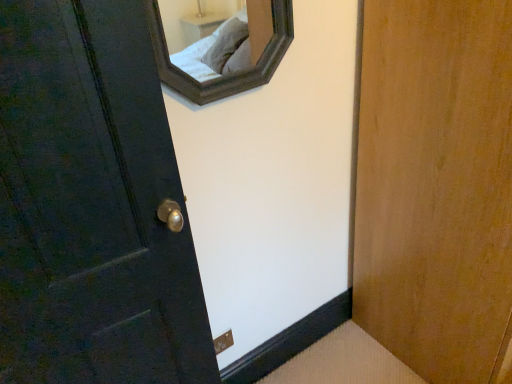
Question: Which direction should I rotate to look at brown matte electric outlet at lower center?

Choices:
 (A) right
 (B) left

Answer: (B)

Question: Are brown matte electric outlet at lower center and matte dark wood door at left far apart?

Choices:
 (A) no
 (B) yes

Answer: (A)

Question: Can you confirm if brown matte electric outlet at lower center is bigger than matte dark wood door at left?

Choices:
 (A) yes
 (B) no

Answer: (B)

Question: Is brown matte electric outlet at lower center wider than matte dark wood door at left?

Choices:
 (A) yes
 (B) no

Answer: (B)

Question: From the image's perspective, is brown matte electric outlet at lower center below matte dark wood door at left?

Choices:
 (A) yes
 (B) no

Answer: (A)

Question: Considering the relative sizes of brown matte electric outlet at lower center and matte dark wood door at left in the image provided, is brown matte electric outlet at lower center shorter than matte dark wood door at left?

Choices:
 (A) yes
 (B) no

Answer: (A)

Question: Can you confirm if brown matte electric outlet at lower center is smaller than matte dark wood door at left?

Choices:
 (A) no
 (B) yes

Answer: (B)

Question: Is matte dark wood door at left facing towards brown matte electric outlet at lower center?

Choices:
 (A) no
 (B) yes

Answer: (A)

Question: Considering the relative positions of matte dark wood door at left and brown matte electric outlet at lower center in the image provided, is matte dark wood door at left to the right of brown matte electric outlet at lower center from the viewer's perspective?

Choices:
 (A) yes
 (B) no

Answer: (B)

Question: Is matte dark wood door at left touching brown matte electric outlet at lower center?

Choices:
 (A) yes
 (B) no

Answer: (B)

Question: From a real-world perspective, is matte dark wood door at left beneath brown matte electric outlet at lower center?

Choices:
 (A) yes
 (B) no

Answer: (B)

Question: From a real-world perspective, is matte dark wood door at left positioned over brown matte electric outlet at lower center based on gravity?

Choices:
 (A) no
 (B) yes

Answer: (B)

Question: Is brown matte electric outlet at lower center inside matte dark wood door at left?

Choices:
 (A) no
 (B) yes

Answer: (A)

Question: Is matte dark wood door at left situated inside brown matte electric outlet at lower center or outside?

Choices:
 (A) outside
 (B) inside

Answer: (A)